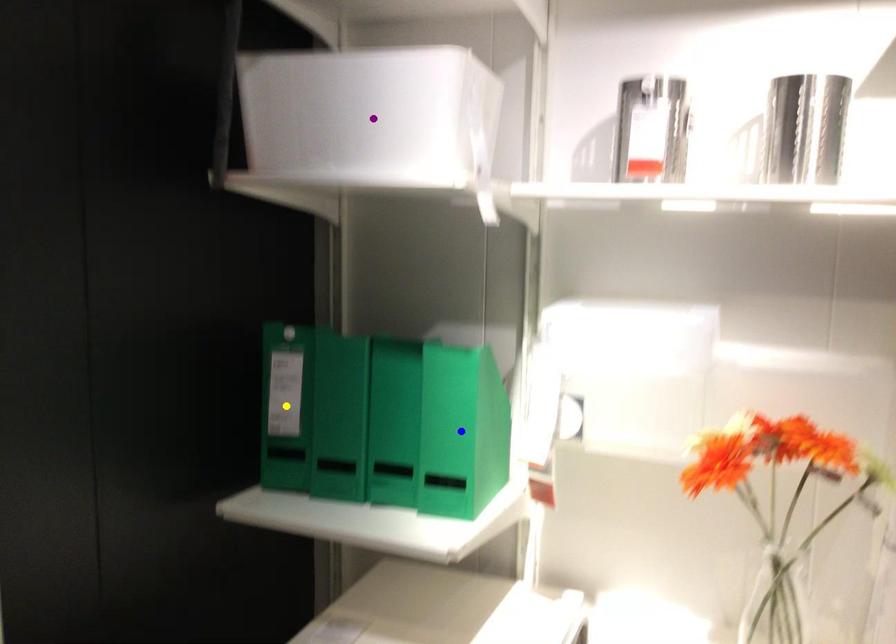
Order these from farthest to nearest:
A) blue point
B) yellow point
C) purple point

yellow point → blue point → purple point